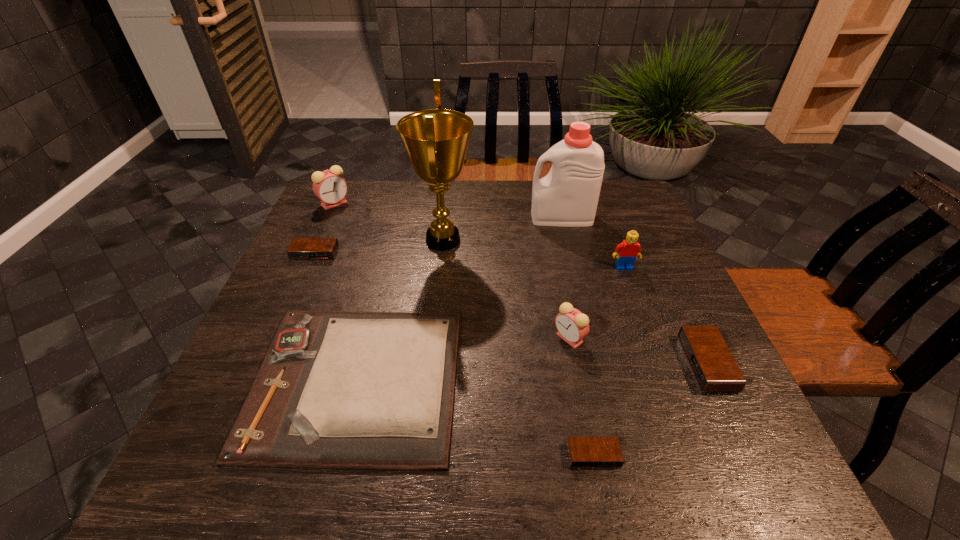
At what (x,y) coordinates should I click in order to perform the action: click on free region at the far edge of the desktop. Please return your answer as a coordinate pair (x, y). The width and height of the screenshot is (960, 540). Looking at the image, I should click on (393, 196).

Identify the location of vacant space at the near edge. Image resolution: width=960 pixels, height=540 pixels. (324, 492).

Locate an element on the screen. free space at the left edge of the desktop is located at coordinates (312, 299).

The width and height of the screenshot is (960, 540). Find the location of `vacant position at the right edge of the desktop`. vacant position at the right edge of the desktop is located at coordinates (731, 419).

The width and height of the screenshot is (960, 540). I want to click on free space at the near left corner of the desktop, so click(213, 453).

Image resolution: width=960 pixels, height=540 pixels. I want to click on free point between the farther pink alarm clock and the brown clipboard, so click(346, 292).

Find the location of a particular element. free space between the nearest black alarm clock and the fourth shortest alarm clock is located at coordinates (582, 396).

Find the location of a particular element. The width and height of the screenshot is (960, 540). empty location between the nearer pink alarm clock and the award is located at coordinates (506, 289).

Identify the location of blank region between the fourth shortest object and the second farthest alarm clock. (511, 308).

You are a GUI agent. You are given a task and a screenshot of the screen. Output one action in this format:
    pyautogui.click(x=<x>, y=<y>)
    Task: Click on the vacant space that's between the gold award and the second black alarm clock from left to right
    
    Given the screenshot: What is the action you would take?
    pyautogui.click(x=518, y=348)